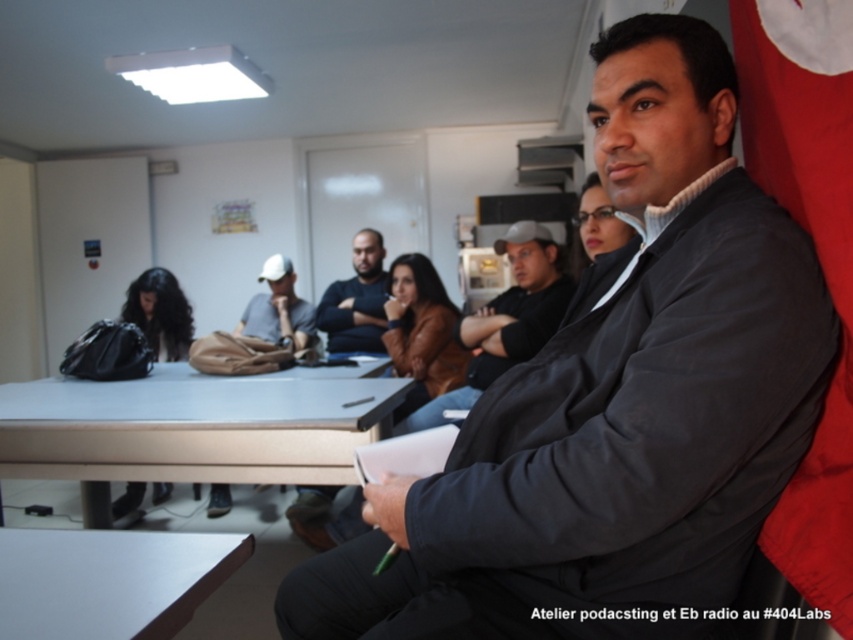
Who is more forward, (799,211) or (361,339)?

Point (799,211) is in front.

In the scene shown: Does red fabric flag at right have a lesser width compared to dark gray sweater at center?

Yes.

Measure the distance between point (851, 125) and camera.

Point (851, 125) is 31.19 inches from camera.

You are a GUI agent. You are given a task and a screenshot of the screen. Output one action in this format:
    pyautogui.click(x=<x>, y=<y>)
    Task: Click on the red fabric flag at right
    The image size is (853, 640).
    Given the screenshot: What is the action you would take?
    pyautogui.click(x=817, y=256)

Which is more to the right, matte black jacket at center or dark gray sweater at center?

matte black jacket at center is more to the right.

Can you confirm if matte black jacket at center is wider than dark gray sweater at center?

Yes.

Is point (421, 428) closer to viewer compared to point (328, 301)?

Yes.

Where is `matte black jacket at center`? The width and height of the screenshot is (853, 640). matte black jacket at center is located at coordinates tap(506, 320).

Does dark gray jacket at center lie behind red fabric flag at right?

No, dark gray jacket at center is closer to the viewer.

Can you confirm if dark gray jacket at center is taller than red fabric flag at right?

Yes, dark gray jacket at center is taller than red fabric flag at right.

Between point (665, 493) and point (828, 16), which one is positioned behind?

The point (828, 16) is more distant.

Find the location of a particular element. dark gray jacket at center is located at coordinates (614, 401).